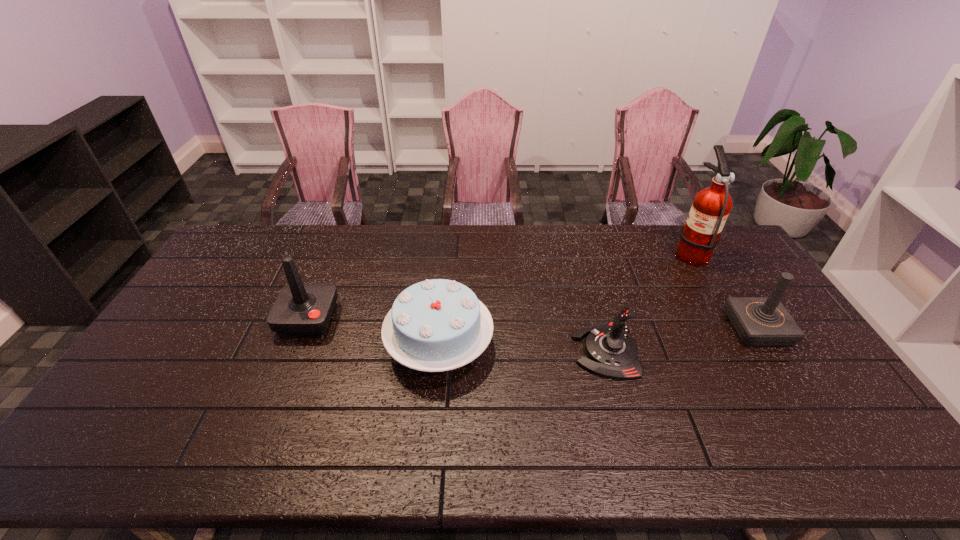
Find the location of a particular element. The width and height of the screenshot is (960, 540). free region located 0.250m on the left of the leftmost object is located at coordinates (200, 319).

At what (x,y) coordinates should I click in order to perform the action: click on free space located 0.060m on the rectangular base of the rightmost joystick. Please return your answer as a coordinate pair (x, y). This screenshot has height=540, width=960. Looking at the image, I should click on (711, 328).

Find the location of a particular element. This screenshot has width=960, height=540. vacant space situated on the rectangular base of the rightmost joystick is located at coordinates (695, 328).

Find the location of `vacant space located 0.370m on the rectangular base of the rightmost joystick`. vacant space located 0.370m on the rectangular base of the rightmost joystick is located at coordinates (609, 328).

In order to click on free space located 0.150m on the right of the birthday cake in this screenshot , I will do `click(544, 345)`.

Locate an element on the screen. This screenshot has width=960, height=540. vacant region located 0.220m on the handle side of the third object from left to right is located at coordinates (496, 351).

Find the location of a particular element. This screenshot has width=960, height=540. vacant area situated 0.230m on the handle side of the third object from left to right is located at coordinates (493, 351).

In order to click on free space located 0.300m on the handle side of the third object from left to right in this screenshot , I will do `click(468, 351)`.

The width and height of the screenshot is (960, 540). In order to click on object at the far edge in this screenshot , I will do `click(701, 234)`.

What are the coordinates of `fire extinguisher located at the right edge` in the screenshot? It's located at (701, 234).